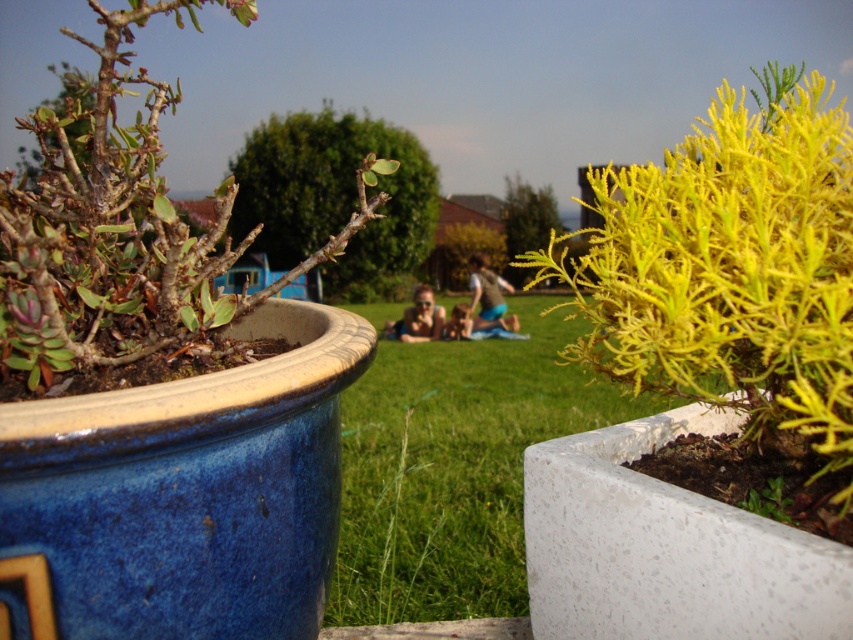
Does green fabric shorts at center have a lesser width compared to matte skin person at center?

Yes.

Which is below, green fabric shorts at center or matte skin person at center?

matte skin person at center is lower down.

The width and height of the screenshot is (853, 640). What do you see at coordinates (488, 296) in the screenshot?
I see `green fabric shorts at center` at bounding box center [488, 296].

Locate an element on the screen. This screenshot has height=640, width=853. green fabric shorts at center is located at coordinates (488, 296).

Between brown textured plant at left and green fabric shorts at center, which one appears on the left side from the viewer's perspective?

brown textured plant at left

Does brown textured plant at left have a lesser height compared to green fabric shorts at center?

Indeed, brown textured plant at left has a lesser height compared to green fabric shorts at center.

Which is in front, point (149, 332) or point (471, 291)?

Point (149, 332) is more forward.

Locate an element on the screen. brown textured plant at left is located at coordinates (120, 237).

In the scene shown: Can you confirm if yellow-green leafy plant at right is positioned to the right of brown textured plant at left?

Yes, yellow-green leafy plant at right is to the right of brown textured plant at left.

Who is more forward, (691, 317) or (207, 276)?

Positioned in front is point (691, 317).

Is point (654, 284) behind point (82, 81)?

No, (654, 284) is closer to viewer.

At what (x,y) coordinates should I click in order to perform the action: click on yellow-green leafy plant at right. Please return your answer as a coordinate pair (x, y). Looking at the image, I should click on (730, 273).